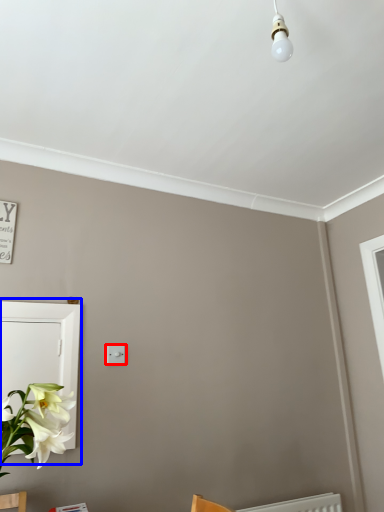
Question: Which object is closer to the camera taking this photo, light switch (highlighted by a red box) or medicine cabinet (highlighted by a blue box)?

Choices:
 (A) light switch
 (B) medicine cabinet

Answer: (B)